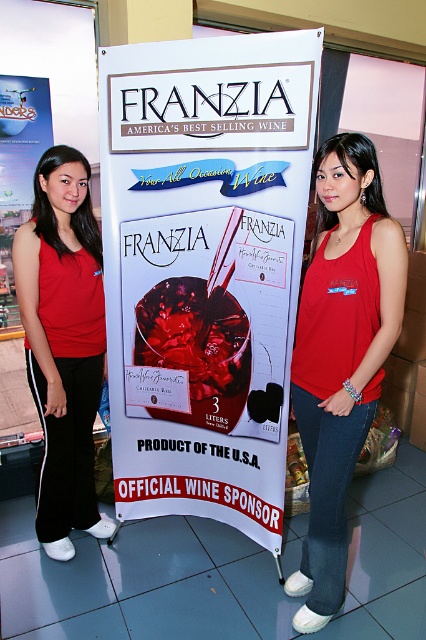
Does white paper poster at center come in front of matte red tank top at center?

Yes, it is in front of matte red tank top at center.

Between white paper poster at center and matte red tank top at center, which one has more height?

white paper poster at center

Which is in front, point (261, 124) or point (57, 445)?

Point (261, 124)

The height and width of the screenshot is (640, 426). In order to click on white paper poster at center in this screenshot , I will do `click(204, 268)`.

Is white paper poster at center to the left of red tank top at center from the viewer's perspective?

Correct, you'll find white paper poster at center to the left of red tank top at center.

Does point (158, 502) come in front of point (374, 157)?

That is False.

You are a GUI agent. You are given a task and a screenshot of the screen. Output one action in this format:
    pyautogui.click(x=<x>, y=<y>)
    Task: Click on the white paper poster at center
    This screenshot has width=426, height=640.
    Given the screenshot: What is the action you would take?
    pyautogui.click(x=204, y=268)

Does red tank top at center appear on the left side of matte red tank top at center?

In fact, red tank top at center is to the right of matte red tank top at center.

Which is in front, point (314, 403) or point (75, 161)?

Point (314, 403) is in front.

Find the location of a particular element. This screenshot has width=426, height=640. red tank top at center is located at coordinates (342, 355).